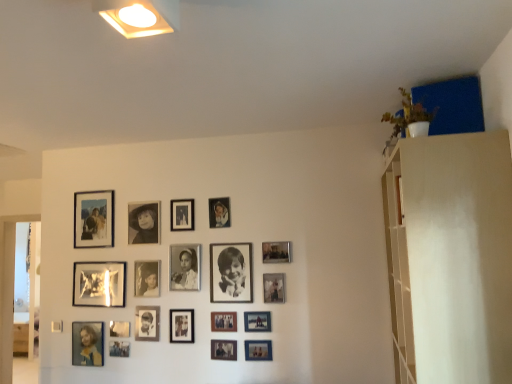
Question: Is point (118, 334) closer or farther from the camera than point (91, 364)?

Choices:
 (A) closer
 (B) farther

Answer: (A)

Question: Is metallic silver picture frame at center, acting as the 4th picture frame starting from the left, wider or thinner than matte blue photo frame at lower left, acting as the first picture frame starting from the left?

Choices:
 (A) wide
 (B) thin

Answer: (B)

Question: Which is nearer to the black matte photo frame at upper center, positioned as the sixth picture frame in left-to-right order?

Choices:
 (A) metallic silver photo frame at lower center, which is the 15th picture frame from right to left
 (B) white matte shelf at upper right
 (C) metallic silver photo frame at upper center, the eighth picture frame in the right-to-left sequence
 (D) black matte picture frame at center, acting as the fifteenth picture frame starting from the left
 (E) matte black photo frame at center, acting as the seventh picture frame starting from the right

Answer: (C)

Question: Which object is the farthest from the metallic silver photo frame at lower center, positioned as the seventeenth picture frame in left-to-right order?

Choices:
 (A) black matte photo frame at center, which ranks as the eleventh picture frame in left-to-right order
 (B) metallic silver photo frame at lower center, positioned as the 5th picture frame in left-to-right order
 (C) metallic silver photo frame at center, the 6th picture frame from the right
 (D) metallic silver photo frame at center, acting as the tenth picture frame starting from the left
 (E) black matte photo frame at center, the twelfth picture frame from the right

Answer: (B)